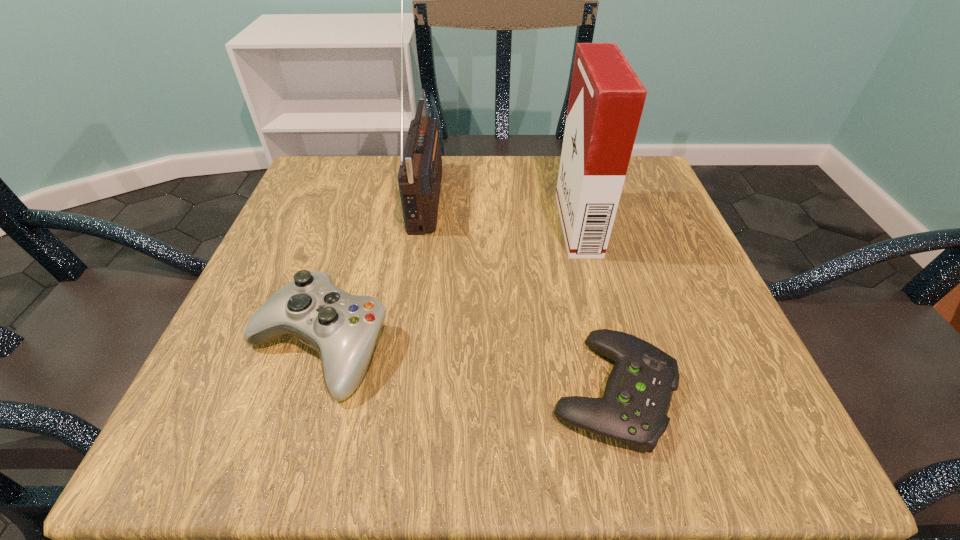
What are the coordinates of `free space between the radio receiver and the taller control` in the screenshot? It's located at (372, 271).

I want to click on free space between the cigarette_case and the third tallest object, so click(x=448, y=285).

At what (x,y) coordinates should I click in order to perform the action: click on free point between the right control and the cigarette_case. Please return your answer as a coordinate pair (x, y). Looking at the image, I should click on (595, 307).

You are a GUI agent. You are given a task and a screenshot of the screen. Output one action in this format:
    pyautogui.click(x=<x>, y=<y>)
    Task: Click on the vacant point located between the left control and the cigarette_case
    The image size is (960, 540).
    Given the screenshot: What is the action you would take?
    pyautogui.click(x=448, y=285)

At what (x,y) coordinates should I click in order to perform the action: click on object that stands as the closest to the right control. Please return your answer as a coordinate pair (x, y). This screenshot has width=960, height=540. Looking at the image, I should click on (606, 101).

Identify the location of object that is the closest to the radio receiver. The height and width of the screenshot is (540, 960). (343, 328).

Locate an element on the screen. vacant space that satisfies the following two spatial constraints: 1. on the front-facing side of the radio receiver; 2. on the front side of the taller control is located at coordinates (404, 346).

Image resolution: width=960 pixels, height=540 pixels. Identify the location of vacant position in the image that satisfies the following two spatial constraints: 1. on the front-facing side of the radio receiver; 2. on the front side of the taller control. (404, 346).

You are a GUI agent. You are given a task and a screenshot of the screen. Output one action in this format:
    pyautogui.click(x=<x>, y=<y>)
    Task: Click on the free spot that satisfies the following two spatial constraints: 1. on the back side of the shortest object; 2. on the front-facing side of the radio receiver
    This screenshot has width=960, height=540.
    Given the screenshot: What is the action you would take?
    point(566,195)

Find the location of `vacant region that satisfies the following two spatial constraints: 1. on the front-facing side of the radio receiver; 2. on the left side of the shorter control`. vacant region that satisfies the following two spatial constraints: 1. on the front-facing side of the radio receiver; 2. on the left side of the shorter control is located at coordinates [x=397, y=390].